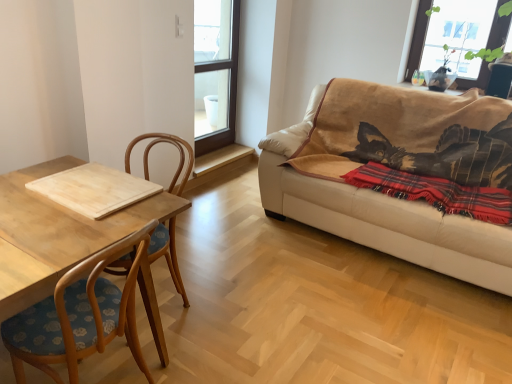
Question: Is light wood cutting board at left in front of red plaid blanket at right?

Choices:
 (A) no
 (B) yes

Answer: (B)

Question: Is light wood cutting board at left oriented away from red plaid blanket at right?

Choices:
 (A) yes
 (B) no

Answer: (B)

Question: Considering the relative sizes of light wood cutting board at left and red plaid blanket at right in the image provided, is light wood cutting board at left wider than red plaid blanket at right?

Choices:
 (A) yes
 (B) no

Answer: (A)

Question: Considering the relative sizes of light wood cutting board at left and red plaid blanket at right in the image provided, is light wood cutting board at left bigger than red plaid blanket at right?

Choices:
 (A) no
 (B) yes

Answer: (B)

Question: From a real-world perspective, is light wood cutting board at left located higher than red plaid blanket at right?

Choices:
 (A) no
 (B) yes

Answer: (A)

Question: In terms of height, does transparent glass window at upper right, which is counted as the second window, starting from the left, look taller or shorter compared to beige leather couch at right?

Choices:
 (A) tall
 (B) short

Answer: (B)

Question: Looking at their shapes, would you say transparent glass window at upper right, which is counted as the second window, starting from the left, is wider or thinner than beige leather couch at right?

Choices:
 (A) thin
 (B) wide

Answer: (A)

Question: Visually, is transparent glass window at upper right, which is the first window from right to left, positioned to the left or to the right of beige leather couch at right?

Choices:
 (A) right
 (B) left

Answer: (A)

Question: From a real-world perspective, is transparent glass window at upper right, which is the first window from right to left, positioned above or below beige leather couch at right?

Choices:
 (A) below
 (B) above

Answer: (B)

Question: In the image, is transparent glass window at upper right, which is the first window from right to left, on the left side or the right side of transparent glass window at upper center, arranged as the 2th window when viewed from the right?

Choices:
 (A) left
 (B) right

Answer: (B)

Question: Considering the positions of transparent glass window at upper right, which is counted as the second window, starting from the left, and transparent glass window at upper center, arranged as the 2th window when viewed from the right, in the image, is transparent glass window at upper right, which is counted as the second window, starting from the left, taller or shorter than transparent glass window at upper center, arranged as the 2th window when viewed from the right,?

Choices:
 (A) tall
 (B) short

Answer: (B)

Question: Looking at the image, does transparent glass window at upper right, which is the first window from right to left, seem bigger or smaller compared to transparent glass window at upper center, which is the first window from left to right?

Choices:
 (A) small
 (B) big

Answer: (A)

Question: From a real-world perspective, is transparent glass window at upper right, which is counted as the second window, starting from the left, above or below transparent glass window at upper center, which is the first window from left to right?

Choices:
 (A) below
 (B) above

Answer: (B)

Question: From their relative heights in the image, would you say red plaid blanket at right is taller or shorter than transparent glass window at upper center, which is the first window from left to right?

Choices:
 (A) short
 (B) tall

Answer: (A)

Question: From a real-world perspective, is red plaid blanket at right positioned above or below transparent glass window at upper center, which is the first window from left to right?

Choices:
 (A) below
 (B) above

Answer: (A)